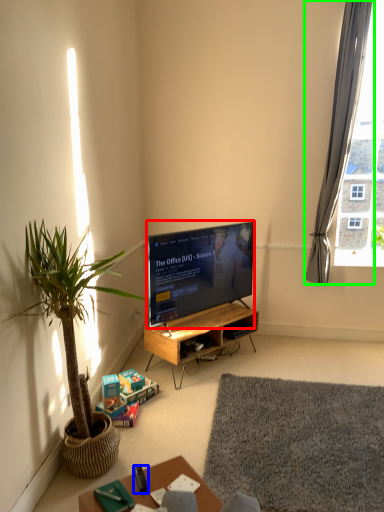
Question: Based on their relative distances, which object is nearer to television (highlighted by a red box)? Choose from remote control (highlighted by a blue box) and curtain (highlighted by a green box).

Choices:
 (A) remote control
 (B) curtain

Answer: (B)